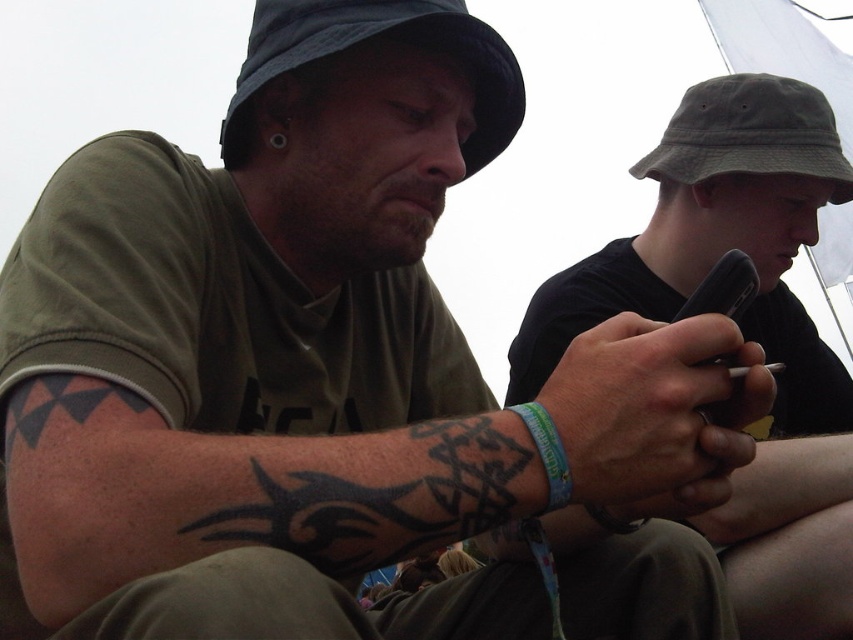
Does dark blue fabric baseball hat at upper left have a greater width compared to green fabric baseball cap at upper right?

Incorrect, dark blue fabric baseball hat at upper left's width does not surpass green fabric baseball cap at upper right's.

Between point (252, 22) and point (767, 97), which one is positioned behind?

The point (767, 97) is behind.

Locate an element on the screen. Image resolution: width=853 pixels, height=640 pixels. dark blue fabric baseball hat at upper left is located at coordinates (383, 36).

Describe the element at coordinates (372, 492) in the screenshot. The height and width of the screenshot is (640, 853). I see `black ink tribal tattoo at lower left` at that location.

Can you confirm if black ink tribal tattoo at lower left is taller than green fabric baseball cap at upper right?

No.

Where is `black ink tribal tattoo at lower left`? This screenshot has height=640, width=853. black ink tribal tattoo at lower left is located at coordinates (372, 492).

In the scene shown: Can you confirm if dark blue fabric baseball hat at upper left is thinner than transparent plastic umbrella at upper right?

Indeed, dark blue fabric baseball hat at upper left has a lesser width compared to transparent plastic umbrella at upper right.

In the scene shown: Is the position of dark blue fabric baseball hat at upper left more distant than that of transparent plastic umbrella at upper right?

No.

Is point (469, 173) positioned before point (776, 0)?

Yes.

At what (x,y) coordinates should I click in order to perform the action: click on dark blue fabric baseball hat at upper left. Please return your answer as a coordinate pair (x, y). The width and height of the screenshot is (853, 640). Looking at the image, I should click on (383, 36).